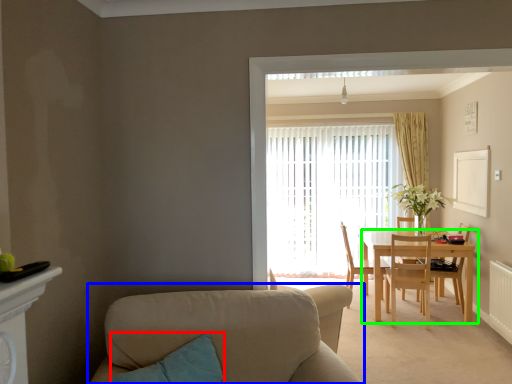
Question: Which object is positioned farthest from pillow (highlighted by a red box)? Select from studio couch (highlighted by a blue box) and kitchen & dining room table (highlighted by a green box).

Choices:
 (A) studio couch
 (B) kitchen & dining room table

Answer: (B)